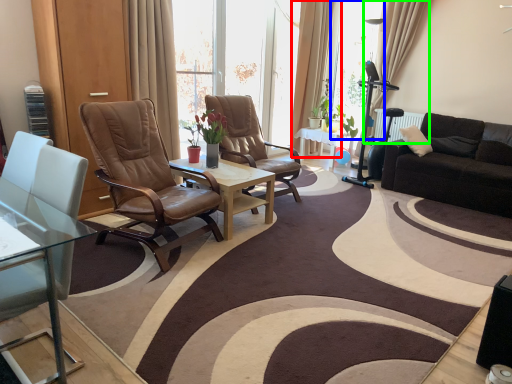
Question: Considering the real-world distances, which object is farthest from curtain (highlighted by a red box)? window screen (highlighted by a blue box) or curtain (highlighted by a green box)?

Choices:
 (A) window screen
 (B) curtain

Answer: (B)